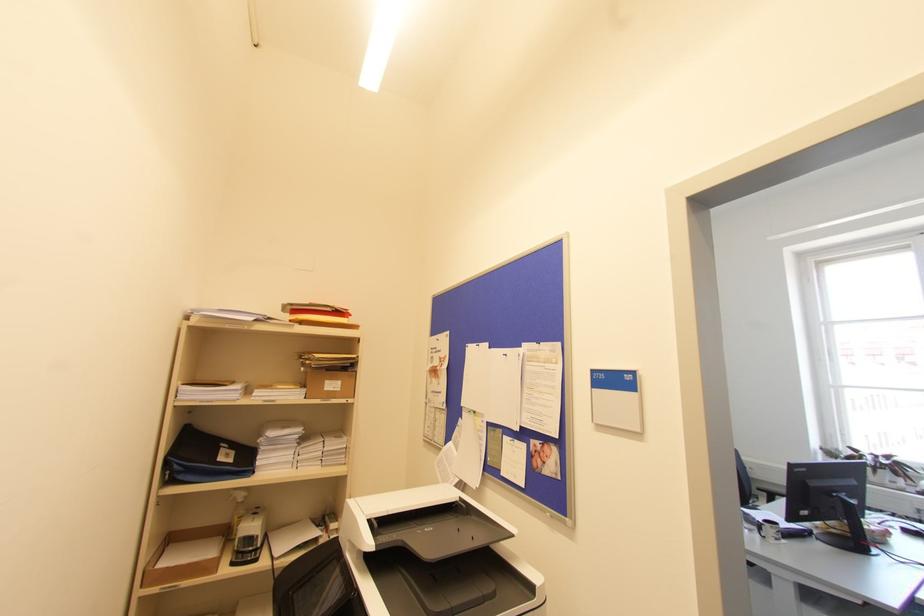
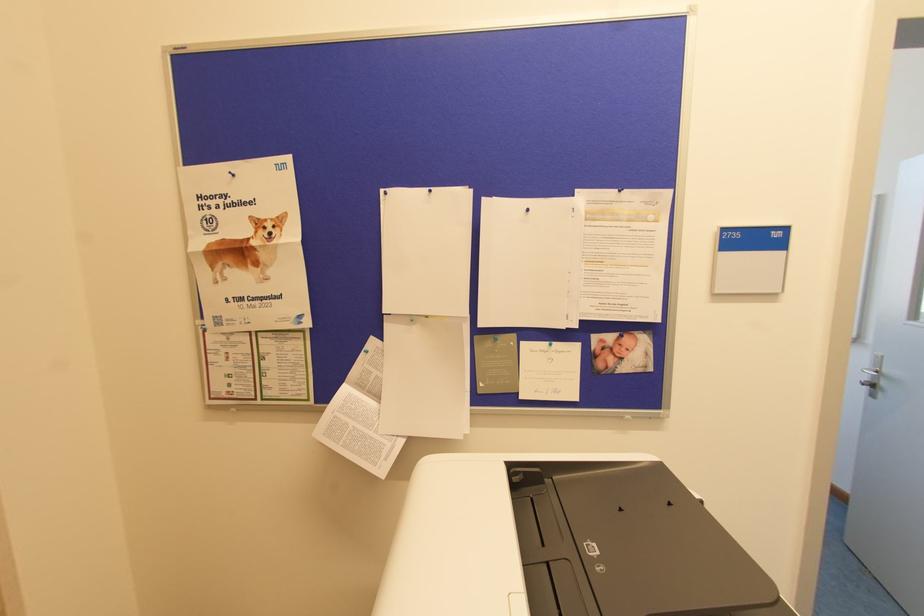
The point at (x=540, y=342) is marked in the first image. Where is the corresponding point in the second image?

(619, 190)